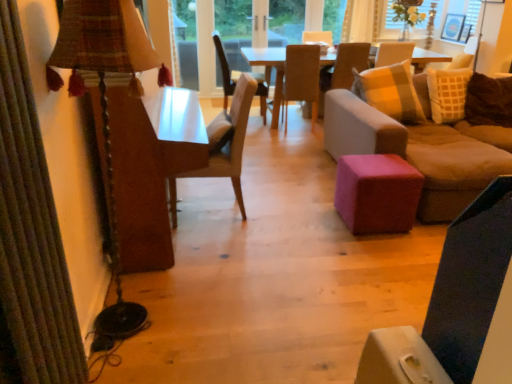
Where is `free location to the right of wooden chair at center, placed as the first chair when sorted from front to back`? free location to the right of wooden chair at center, placed as the first chair when sorted from front to back is located at coordinates (283, 211).